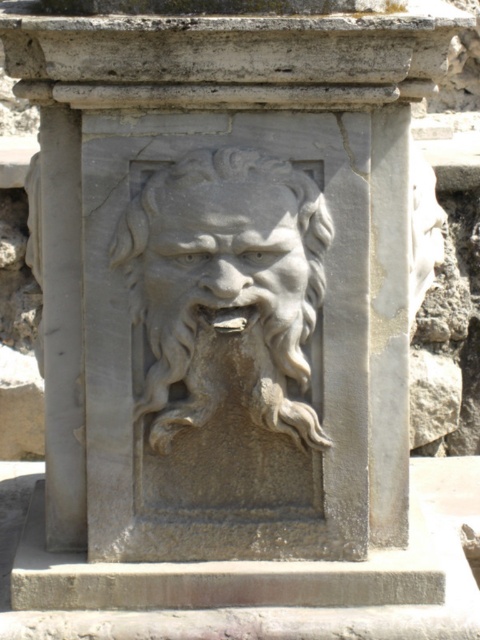
Which is behind, point (260, 362) or point (229, 292)?

Positioned behind is point (260, 362).

Is point (317, 221) positioned before point (172, 209)?

No, (317, 221) is further to viewer.

At what (x,y) coordinates should I click in order to perform the action: click on gray stone lion at center. Please return your answer as a coordinate pair (x, y). Looking at the image, I should click on (226, 289).

This screenshot has height=640, width=480. What are the coordinates of `gray stone lion at center` in the screenshot? It's located at pos(226,289).